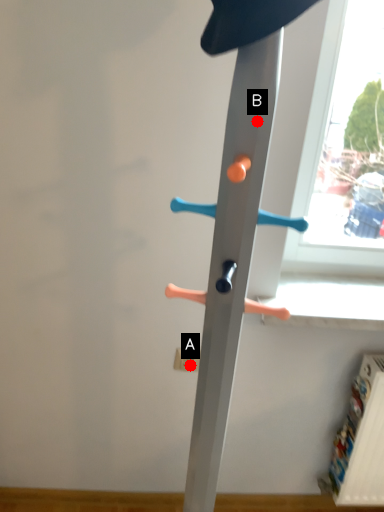
Question: Two points are circled on the image, labeled by A and B beside each circle. Which point is further to the camera?

Choices:
 (A) A is further
 (B) B is further

Answer: (A)